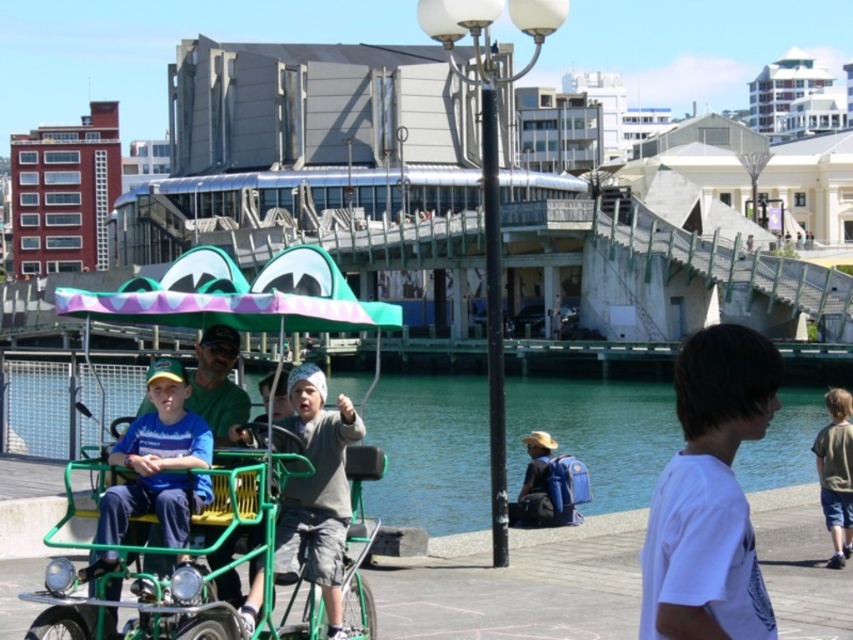
You are a photographer trying to capture a candid shot of the white matte shirt at lower right and the dark green fabric shorts at lower right. Since you want to ensure both are in focus, you need to know which object is narrower. Which one is thinner?

The white matte shirt at lower right is thinner than the dark green fabric shorts at lower right.

You are a photographer standing at the waterfront and want to take a photo of the green matte tricycle at center and the blue matte shirt at center. Which object should you focus on first to ensure it appears larger in the photo?

The green matte tricycle at center is closer to the viewer than the blue matte shirt at center, so focusing on it first will make it appear larger in the photo.